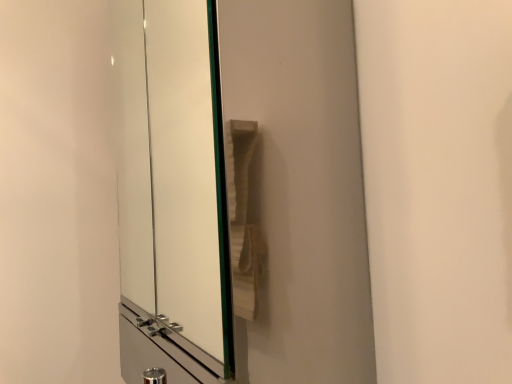
Describe the element at coordinates (296, 192) in the screenshot. This screenshot has width=512, height=384. I see `clear glass door at center` at that location.

The height and width of the screenshot is (384, 512). What are the coordinates of `clear glass door at center` in the screenshot? It's located at (296, 192).

In order to click on clear glass door at center in this screenshot , I will do `click(296, 192)`.